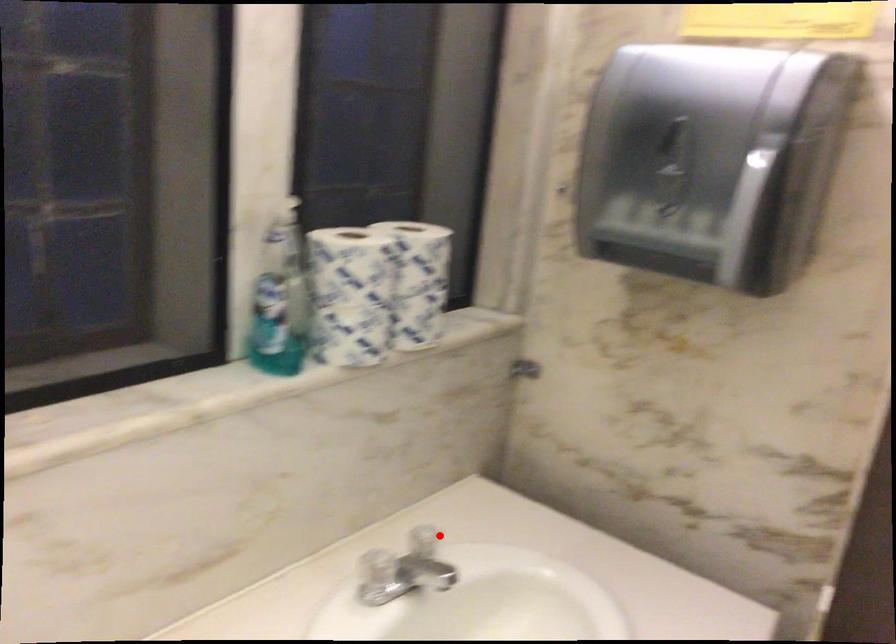
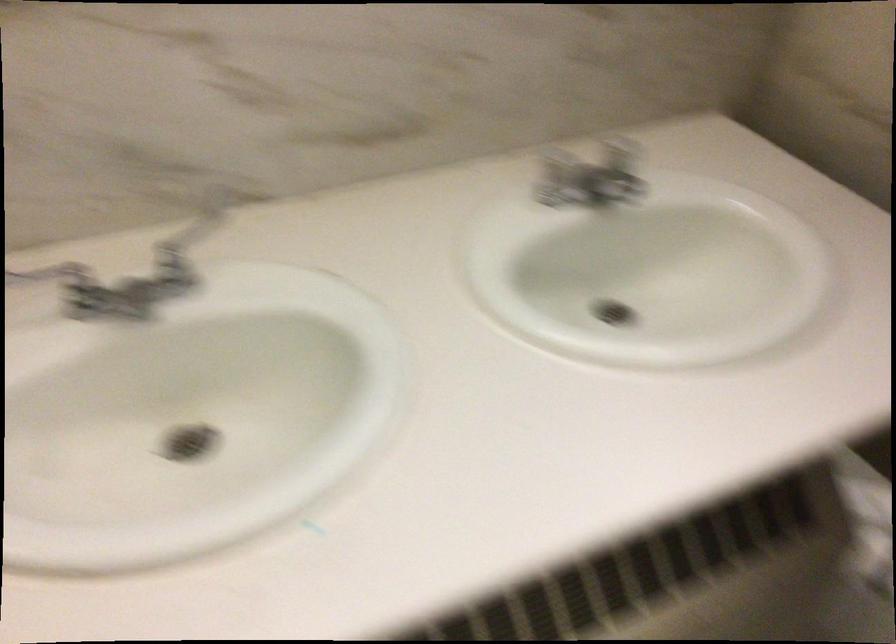
Find the pixel in the second image that matches the highlighted location in the first image.

(622, 147)